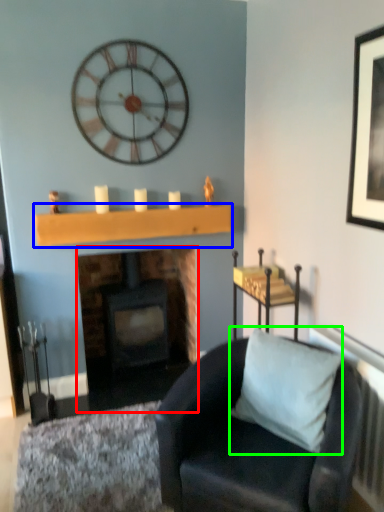
Question: Which is farther away from fireplace (highlighted by a red box)? shelf (highlighted by a blue box) or pillow (highlighted by a green box)?

Choices:
 (A) shelf
 (B) pillow

Answer: (B)